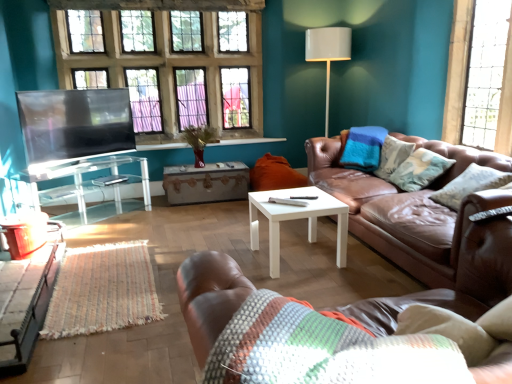
This screenshot has height=384, width=512. What do you see at coordinates (210, 297) in the screenshot?
I see `brown leather couch at lower right, the 2th studio couch from the back` at bounding box center [210, 297].

The width and height of the screenshot is (512, 384). Find the location of `white glossy floor lamp at upper right`. white glossy floor lamp at upper right is located at coordinates (328, 53).

What do you see at coordinates (328, 53) in the screenshot?
I see `white glossy floor lamp at upper right` at bounding box center [328, 53].

The image size is (512, 384). I want to click on wooden textured table at lower left, the third table viewed from the back, so click(27, 299).

The width and height of the screenshot is (512, 384). Describe the element at coordinates (457, 70) in the screenshot. I see `clear glass window at upper right, the second window viewed from the left` at that location.

The image size is (512, 384). Describe the element at coordinates (170, 62) in the screenshot. I see `clear glass windows at upper left, positioned as the second window in front-to-back order` at that location.

What do you see at coordinates (406, 207) in the screenshot? The height and width of the screenshot is (384, 512). I see `brown leather couch at right, positioned as the second studio couch in front-to-back order` at bounding box center [406, 207].

Find the location of `brown leather couch at lower right, the 2th studio couch from the back`. brown leather couch at lower right, the 2th studio couch from the back is located at coordinates tap(210, 297).

Considering the sizes of objects transparent glass table at left, which is the second table from front to back, and white glossy floor lamp at upper right in the image provided, who is wider, transparent glass table at left, which is the second table from front to back, or white glossy floor lamp at upper right?

transparent glass table at left, which is the second table from front to back.

Find the location of a particular element. the 2nd table in front of the white glossy floor lamp at upper right is located at coordinates click(x=82, y=180).

Is transparent glass table at left, marked as the second table in a back-to-front arrangement, beside white glossy floor lamp at upper right?

There is a gap between transparent glass table at left, marked as the second table in a back-to-front arrangement, and white glossy floor lamp at upper right.

Considering the relative sizes of orange fabric pillow at center, the second pillow from the front, and wooden textured table at lower left, the third table viewed from the back, in the image provided, is orange fabric pillow at center, the second pillow from the front, thinner than wooden textured table at lower left, the third table viewed from the back,?

No, orange fabric pillow at center, the second pillow from the front, is not thinner than wooden textured table at lower left, the third table viewed from the back.

Based on the photo, considering the positions of objects orange fabric pillow at center, marked as the 2th pillow in a right-to-left arrangement, and wooden textured table at lower left, which is counted as the first table, starting from the front, in the image provided, who is more to the left, orange fabric pillow at center, marked as the 2th pillow in a right-to-left arrangement, or wooden textured table at lower left, which is counted as the first table, starting from the front,?

From the viewer's perspective, wooden textured table at lower left, which is counted as the first table, starting from the front, appears more on the left side.

Is orange fabric pillow at center, arranged as the first pillow when viewed from the left, oriented away from wooden textured table at lower left, which is counted as the first table, starting from the front?

No, wooden textured table at lower left, which is counted as the first table, starting from the front, is not at the back of orange fabric pillow at center, arranged as the first pillow when viewed from the left.

Considering the relative sizes of orange fabric pillow at center, arranged as the first pillow when viewed from the left, and wooden textured table at lower left, the third table viewed from the back, in the image provided, is orange fabric pillow at center, arranged as the first pillow when viewed from the left, smaller than wooden textured table at lower left, the third table viewed from the back,?

No, orange fabric pillow at center, arranged as the first pillow when viewed from the left, is not smaller than wooden textured table at lower left, the third table viewed from the back.

In the scene shown: Is clear glass windows at upper left, the second window when ordered from right to left, situated inside white glossy floor lamp at upper right or outside?

clear glass windows at upper left, the second window when ordered from right to left, cannot be found inside white glossy floor lamp at upper right.

From the image's perspective, between clear glass windows at upper left, acting as the first window starting from the back, and white glossy floor lamp at upper right, who is located below?

white glossy floor lamp at upper right, from the image's perspective.

From a real-world perspective, between clear glass windows at upper left, positioned as the second window in front-to-back order, and white glossy floor lamp at upper right, who is vertically higher?

clear glass windows at upper left, positioned as the second window in front-to-back order.

Is point (118, 118) closer to viewer compared to point (259, 167)?

Yes.

Is orange fabric pillow at center, which is counted as the 1th pillow, starting from the back, at the back of flat matte screen at left?

No, flat matte screen at left is not facing away from orange fabric pillow at center, which is counted as the 1th pillow, starting from the back.

How many degrees apart are the facing directions of flat matte screen at left and orange fabric pillow at center, arranged as the first pillow when viewed from the left?

The angle between the facing direction of flat matte screen at left and the facing direction of orange fabric pillow at center, arranged as the first pillow when viewed from the left, is 39.1 degrees.

Image resolution: width=512 pixels, height=384 pixels. In order to click on window screen positioned vertically above the orange fabric pillow at center, marked as the 2th pillow in a right-to-left arrangement (from a real-world perspective) in this screenshot , I will do `click(75, 124)`.

Which is behind, point (222, 87) or point (444, 140)?

The point (222, 87) is farther from the camera.

Which is in front, clear glass windows at upper left, positioned as the second window in front-to-back order, or clear glass window at upper right, acting as the second window starting from the back?

clear glass window at upper right, acting as the second window starting from the back, is in front.

From a real-world perspective, is clear glass windows at upper left, marked as the 1th window in a left-to-right arrangement, located beneath clear glass window at upper right, which appears as the first window when viewed from the right?

Incorrect, from a real-world perspective, clear glass windows at upper left, marked as the 1th window in a left-to-right arrangement, is higher than clear glass window at upper right, which appears as the first window when viewed from the right.

Considering the sizes of objects clear glass windows at upper left, acting as the first window starting from the back, and clear glass window at upper right, the 1th window when ordered from front to back, in the image provided, who is shorter, clear glass windows at upper left, acting as the first window starting from the back, or clear glass window at upper right, the 1th window when ordered from front to back,?

With less height is clear glass window at upper right, the 1th window when ordered from front to back.

Would you consider wooden chest at center, acting as the 3th table starting from the front, to be distant from clear glass windows at upper left, positioned as the second window in front-to-back order?

Yes, wooden chest at center, acting as the 3th table starting from the front, is far from clear glass windows at upper left, positioned as the second window in front-to-back order.

Does point (208, 167) lie behind point (259, 96)?

That is False.

From the image's perspective, would you say wooden chest at center, acting as the 3th table starting from the front, is shown under clear glass windows at upper left, the second window when ordered from right to left?

Yes, from the image's perspective, wooden chest at center, acting as the 3th table starting from the front, is below clear glass windows at upper left, the second window when ordered from right to left.

Between wooden chest at center, acting as the 3th table starting from the front, and clear glass windows at upper left, positioned as the second window in front-to-back order, which one has less height?

wooden chest at center, acting as the 3th table starting from the front.

At what (x,y) coordinates should I click in order to perform the action: click on coffee table that is under the flat matte screen at left (from a real-world perspective). Please return your answer as a coordinate pair (x, y). Looking at the image, I should click on (296, 218).

Measure the distance between flat matte screen at left and white glossy coffee table at center.

The distance of flat matte screen at left from white glossy coffee table at center is 6.23 feet.

Is flat matte screen at left wider or thinner than white glossy coffee table at center?

flat matte screen at left is thinner than white glossy coffee table at center.

Which point is more forward, (30, 105) or (289, 193)?

The point (289, 193) is in front.

The width and height of the screenshot is (512, 384). Find the location of `lamp on the right of transparent glass table at left, marked as the second table in a back-to-front arrangement`. lamp on the right of transparent glass table at left, marked as the second table in a back-to-front arrangement is located at coordinates (328, 53).

You are a GUI agent. You are given a task and a screenshot of the screen. Output one action in this format:
    pyautogui.click(x=<x>, y=<y>)
    Task: Click on the 3rd table in front of the orange fabric pillow at center, arranged as the first pillow when viewed from the left, counting from the anchor's position
    
    Given the screenshot: What is the action you would take?
    point(27,299)

Considering their positions, is textured beige pillow at right, the 1th pillow positioned from the front, positioned further to clear glass windows at upper left, acting as the first window starting from the back, than wooden textured table at lower left, the third table viewed from the back?

textured beige pillow at right, the 1th pillow positioned from the front, lies further to clear glass windows at upper left, acting as the first window starting from the back, than the other object.

Considering their positions, is flat matte screen at left positioned closer to brown leather couch at right, which is the second studio couch from left to right, than brown leather couch at lower right, which is counted as the 2th studio couch, starting from the right?

brown leather couch at lower right, which is counted as the 2th studio couch, starting from the right.

When comparing their distances from white glossy coffee table at center, does clear glass windows at upper left, positioned as the second window in front-to-back order, or transparent glass table at left, marked as the second table in a back-to-front arrangement, seem further?

Among the two, clear glass windows at upper left, positioned as the second window in front-to-back order, is located further to white glossy coffee table at center.

When comparing their distances from wooden chest at center, acting as the 3th table starting from the front, does clear glass windows at upper left, acting as the first window starting from the back, or brown leather couch at right, positioned as the second studio couch in front-to-back order, seem closer?

clear glass windows at upper left, acting as the first window starting from the back, is positioned closer to the anchor wooden chest at center, acting as the 3th table starting from the front.

From the image, which object appears to be nearer to brown leather couch at lower right, the 2th studio couch from the back, wooden textured table at lower left, which is counted as the first table, starting from the front, or textured beige pillow at right, which is the 2th pillow in left-to-right order?

wooden textured table at lower left, which is counted as the first table, starting from the front.

Looking at the image, which one is located closer to clear glass window at upper right, the second window viewed from the left, wooden textured table at lower left, which is counted as the first table, starting from the front, or transparent glass table at left, which is the second table from front to back?

transparent glass table at left, which is the second table from front to back, is positioned closer to the anchor clear glass window at upper right, the second window viewed from the left.

From the image, which object appears to be farther from brown leather couch at lower right, the first studio couch viewed from the front, brown leather couch at right, which ranks as the first studio couch in back-to-front order, or wooden chest at center, the 1th table from the back?

wooden chest at center, the 1th table from the back.

Looking at the image, which one is located closer to brown leather couch at right, which ranks as the first studio couch in back-to-front order, textured beige pillow at right, the 1th pillow positioned from the front, or orange fabric pillow at center, arranged as the first pillow when viewed from the left?

Among the two, textured beige pillow at right, the 1th pillow positioned from the front, is located nearer to brown leather couch at right, which ranks as the first studio couch in back-to-front order.

I want to click on table between clear glass windows at upper left, positioned as the second window in front-to-back order, and white glossy floor lamp at upper right, in the horizontal direction, so click(x=206, y=183).

Image resolution: width=512 pixels, height=384 pixels. Identify the location of lamp between transparent glass table at left, marked as the second table in a back-to-front arrangement, and textured beige pillow at right, which appears as the second pillow when viewed from the back, in the horizontal direction. (328, 53).

Where is `pillow between wooden chest at center, the 1th table from the back, and white glossy floor lamp at upper right`? The image size is (512, 384). pillow between wooden chest at center, the 1th table from the back, and white glossy floor lamp at upper right is located at coordinates (275, 174).

Find the location of a particular element. The width and height of the screenshot is (512, 384). window between transparent glass table at left, marked as the second table in a back-to-front arrangement, and orange fabric pillow at center, arranged as the first pillow when viewed from the left, from left to right is located at coordinates point(170,62).